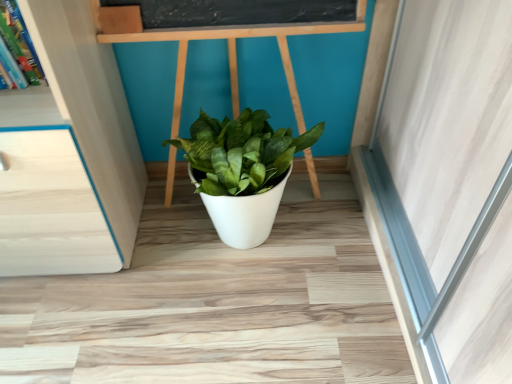
Question: Should I look upward or downward to see white matte pot at center?

Choices:
 (A) down
 (B) up

Answer: (B)

Question: Is white matte pot at center to the right of wooden bookshelf at upper left from the viewer's perspective?

Choices:
 (A) yes
 (B) no

Answer: (A)

Question: Is wooden bookshelf at upper left completely or partially inside white matte pot at center?

Choices:
 (A) yes
 (B) no

Answer: (B)

Question: Does white matte pot at center have a lesser height compared to wooden bookshelf at upper left?

Choices:
 (A) no
 (B) yes

Answer: (A)

Question: Can you confirm if white matte pot at center is thinner than wooden bookshelf at upper left?

Choices:
 (A) no
 (B) yes

Answer: (A)

Question: Considering the relative sizes of white matte pot at center and wooden bookshelf at upper left in the image provided, is white matte pot at center smaller than wooden bookshelf at upper left?

Choices:
 (A) no
 (B) yes

Answer: (A)

Question: Is the position of white matte pot at center more distant than that of wooden bookshelf at upper left?

Choices:
 (A) no
 (B) yes

Answer: (B)

Question: Is wooden bookshelf at upper left positioned far away from white matte pot at center?

Choices:
 (A) no
 (B) yes

Answer: (A)

Question: From a real-world perspective, is wooden bookshelf at upper left on top of white matte pot at center?

Choices:
 (A) yes
 (B) no

Answer: (A)

Question: From the image's perspective, is wooden bookshelf at upper left under white matte pot at center?

Choices:
 (A) no
 (B) yes

Answer: (A)

Question: Are wooden bookshelf at upper left and white matte pot at center beside each other?

Choices:
 (A) no
 (B) yes

Answer: (A)

Question: Is wooden bookshelf at upper left bigger than white matte pot at center?

Choices:
 (A) no
 (B) yes

Answer: (A)

Question: Does wooden bookshelf at upper left appear on the right side of white matte pot at center?

Choices:
 (A) yes
 (B) no

Answer: (B)

Question: In terms of size, does white matte pot at center appear bigger or smaller than wooden bookshelf at upper left?

Choices:
 (A) big
 (B) small

Answer: (A)